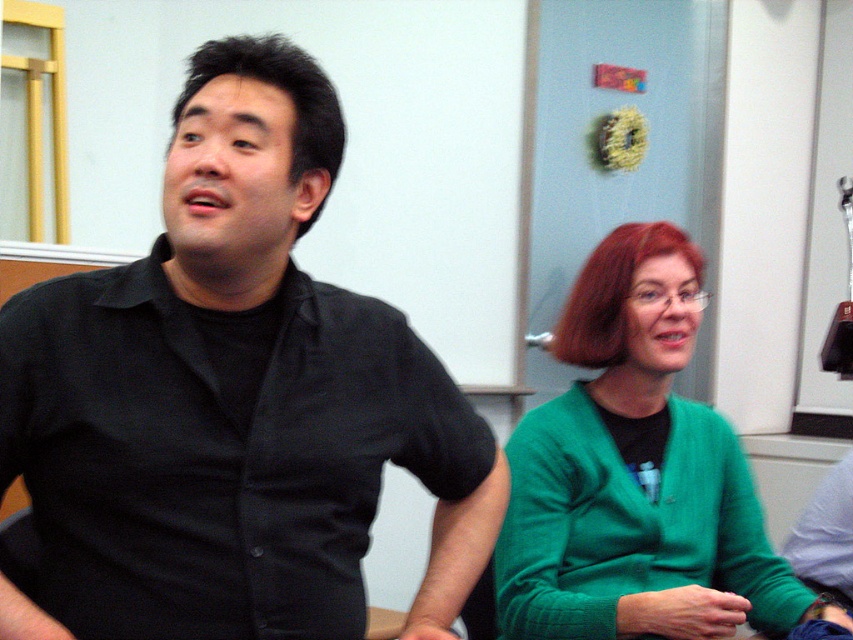
Question: Can you confirm if black matte shirt at left is positioned below green sweater at center?

Choices:
 (A) no
 (B) yes

Answer: (A)

Question: Which point is closer to the camera?

Choices:
 (A) (253, 348)
 (B) (569, 524)

Answer: (A)

Question: Is black matte shirt at left bigger than green sweater at center?

Choices:
 (A) no
 (B) yes

Answer: (A)

Question: Which of the following is the closest to the observer?

Choices:
 (A) (306, 358)
 (B) (508, 573)

Answer: (A)

Question: Which point appears closest to the camera in this image?

Choices:
 (A) (318, 524)
 (B) (688, 451)

Answer: (A)

Question: Is black matte shirt at left above green sweater at center?

Choices:
 (A) yes
 (B) no

Answer: (A)